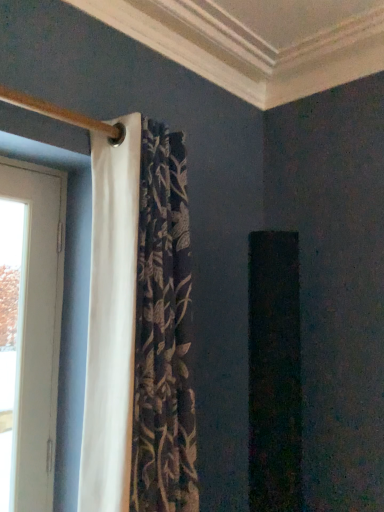
Question: Considering their positions, is white fabric curtain at left located in front of or behind white wood door at left?

Choices:
 (A) front
 (B) behind

Answer: (A)

Question: Is white fabric curtain at left wider or thinner than white wood door at left?

Choices:
 (A) wide
 (B) thin

Answer: (A)

Question: Is point (178, 268) positioned closer to the camera than point (43, 318)?

Choices:
 (A) farther
 (B) closer

Answer: (B)

Question: From the image's perspective, relative to white fabric curtain at left, is white wood door at left above or below?

Choices:
 (A) below
 (B) above

Answer: (A)

Question: Choose the correct answer: Is white wood door at left inside white fabric curtain at left or outside it?

Choices:
 (A) inside
 (B) outside

Answer: (B)

Question: Relative to white fabric curtain at left, is white wood door at left in front or behind?

Choices:
 (A) behind
 (B) front

Answer: (A)

Question: Considering the positions of white wood door at left and white fabric curtain at left in the image, is white wood door at left bigger or smaller than white fabric curtain at left?

Choices:
 (A) small
 (B) big

Answer: (A)